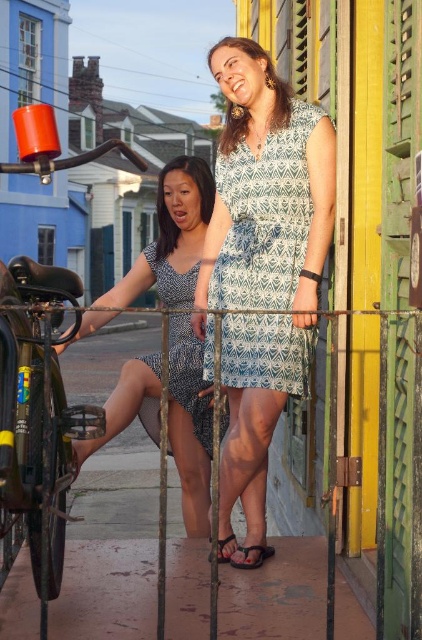
You are taking a photo of two women leaning against a metal railing. You notice two points marked in the image. The first point is at coordinates point (40,524) and the second point is at point (229,534). Which point is closer to the camera?

The point at coordinates point (40,524) is closer to the camera than the point at point (229,534).

Based on the photo, you are trying to decide whether to take the shiny black bicycle at left or the black rubber sandal at lower center with you on a hiking trip. Considering their sizes, which item is taller?

The shiny black bicycle at left is taller than the black rubber sandal at lower center.